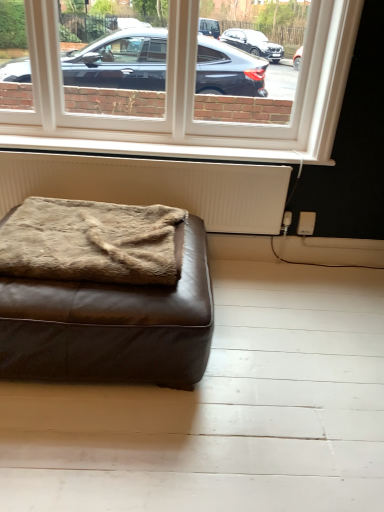
Locate an element on the screen. The width and height of the screenshot is (384, 512). free point to the right of brown leather ottoman at lower left is located at coordinates (270, 353).